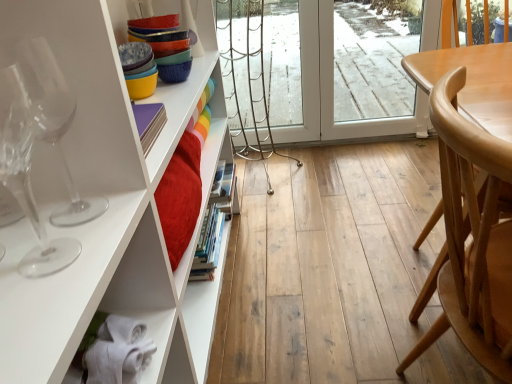
Question: Is the surface of light brown wood chair at right in direct contact with transparent glass wine glass at left, the 1th wine glass when ordered from back to front?

Choices:
 (A) yes
 (B) no

Answer: (B)

Question: Is light brown wood chair at right taller than transparent glass wine glass at left, the 1th wine glass when ordered from back to front?

Choices:
 (A) no
 (B) yes

Answer: (B)

Question: Considering the relative sizes of light brown wood chair at right and transparent glass wine glass at left, the 1th wine glass when ordered from back to front, in the image provided, is light brown wood chair at right smaller than transparent glass wine glass at left, the 1th wine glass when ordered from back to front,?

Choices:
 (A) yes
 (B) no

Answer: (B)

Question: Can you confirm if light brown wood chair at right is thinner than transparent glass wine glass at left, the 1th wine glass when ordered from back to front?

Choices:
 (A) yes
 (B) no

Answer: (B)

Question: From a real-world perspective, is light brown wood chair at right located higher than transparent glass wine glass at left, the 1th wine glass when ordered from back to front?

Choices:
 (A) no
 (B) yes

Answer: (A)

Question: Could you tell me if light brown wood chair at right is turned towards transparent glass wine glass at left, the 1th wine glass when ordered from back to front?

Choices:
 (A) no
 (B) yes

Answer: (A)

Question: Is light brown wood chair at right positioned with its back to transparent glass wine glass at left, the first wine glass viewed from the front?

Choices:
 (A) yes
 (B) no

Answer: (A)

Question: Is light brown wood chair at right next to transparent glass wine glass at left, arranged as the second wine glass when viewed from the back, and touching it?

Choices:
 (A) yes
 (B) no

Answer: (B)

Question: From a real-world perspective, is light brown wood chair at right located beneath transparent glass wine glass at left, arranged as the second wine glass when viewed from the back?

Choices:
 (A) no
 (B) yes

Answer: (B)

Question: Does light brown wood chair at right have a lesser height compared to transparent glass wine glass at left, the first wine glass viewed from the front?

Choices:
 (A) no
 (B) yes

Answer: (A)

Question: Can you confirm if light brown wood chair at right is wider than transparent glass wine glass at left, the first wine glass viewed from the front?

Choices:
 (A) no
 (B) yes

Answer: (B)

Question: Can you confirm if light brown wood chair at right is positioned to the left of transparent glass wine glass at left, arranged as the second wine glass when viewed from the back?

Choices:
 (A) no
 (B) yes

Answer: (A)

Question: Is transparent glass wine glass at left, the 1th wine glass when ordered from back to front, beside light brown wood chair at right?

Choices:
 (A) yes
 (B) no

Answer: (B)